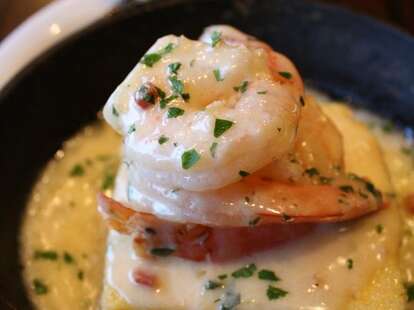
Identify the location of bowl. Image resolution: width=414 pixels, height=310 pixels. tap(106, 47).